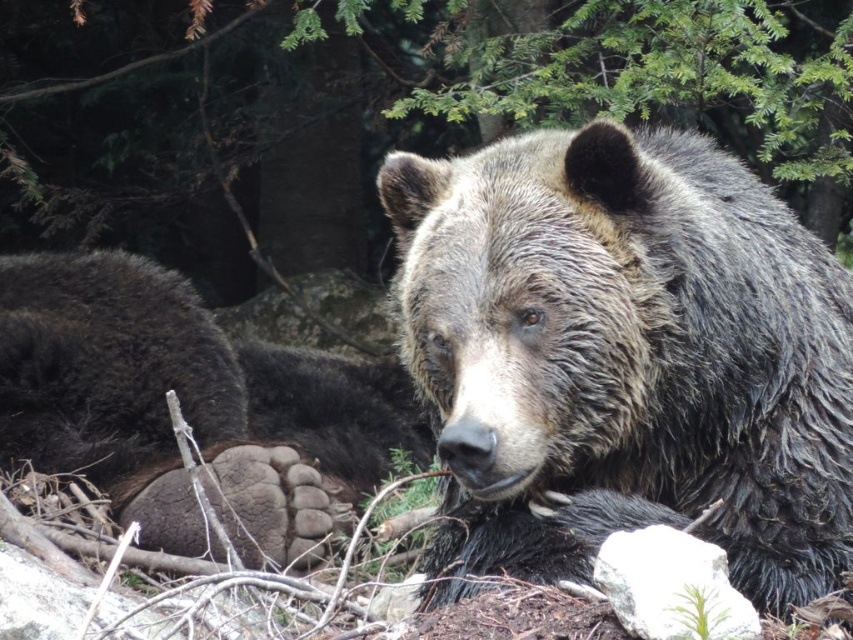
You are a wildlife photographer aiming to capture the brown fur bear at center and the brown fur paw at center in a single frame. Based on their heights, which one should you focus on first to ensure both are in the frame?

The brown fur bear at center is shorter than the brown fur paw at center, so you should focus on the brown fur paw at center first to ensure both are in the frame.